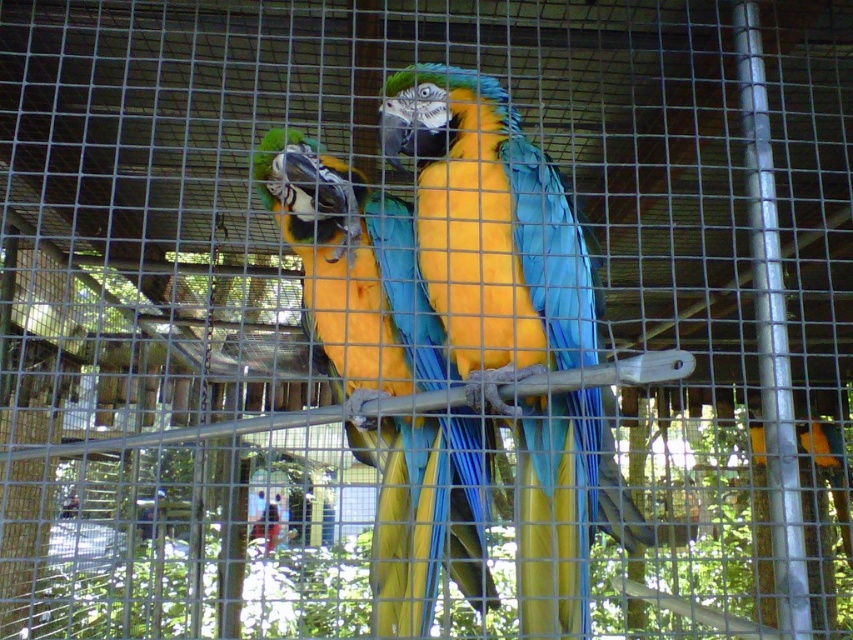
Question: Does blue glossy parrot at center appear on the left side of shiny blue parrot at center?

Choices:
 (A) yes
 (B) no

Answer: (B)

Question: Does blue glossy parrot at center appear on the left side of shiny blue parrot at center?

Choices:
 (A) no
 (B) yes

Answer: (A)

Question: Considering the relative positions of blue glossy parrot at center and shiny blue parrot at center in the image provided, where is blue glossy parrot at center located with respect to shiny blue parrot at center?

Choices:
 (A) left
 (B) right

Answer: (B)